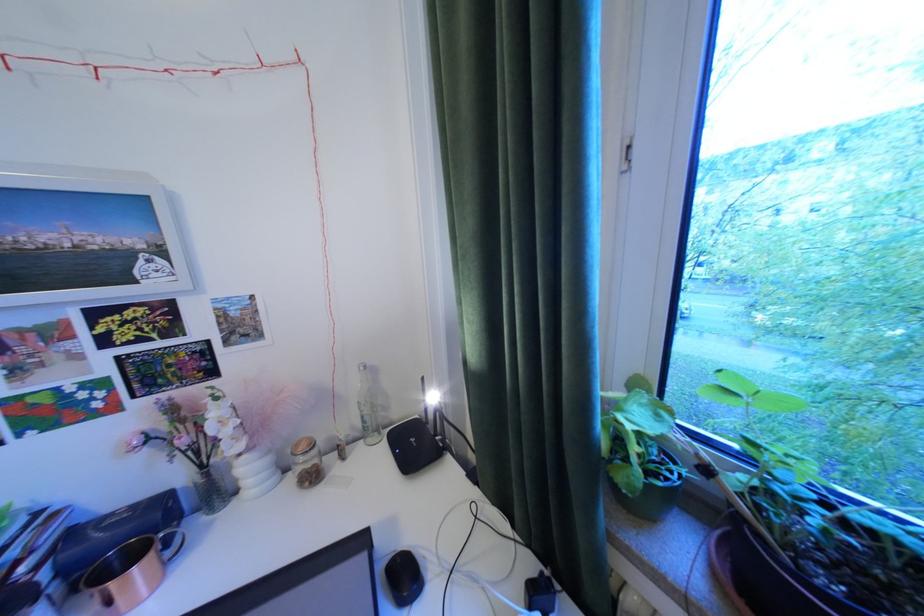
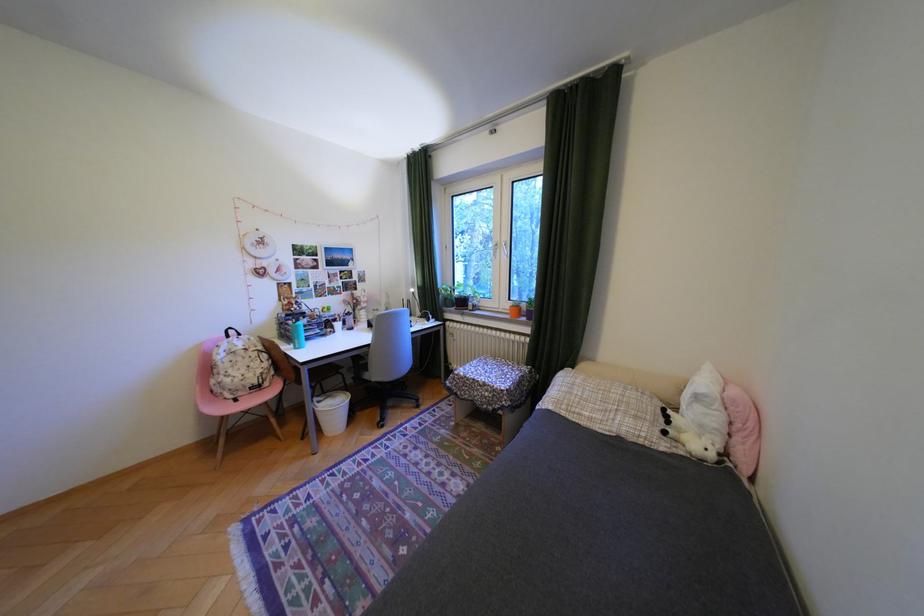
Question: Which direction would the cameraman need to move to produce the second image? Reply with the corresponding letter.

Choices:
 (A) Left
 (B) Right
 (C) Forward
 (D) Backward

Answer: (D)